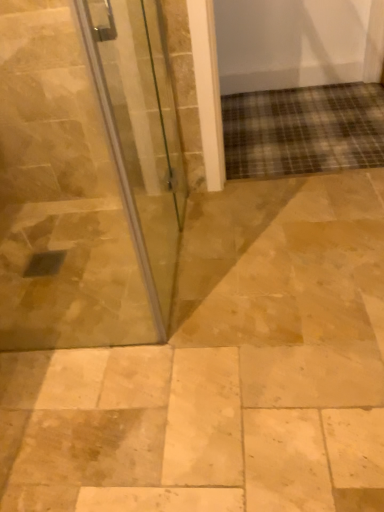
Question: Is natural stone tile at center far away from transparent glass door at left?

Choices:
 (A) yes
 (B) no

Answer: (B)

Question: From a real-world perspective, is natural stone tile at center on top of transparent glass door at left?

Choices:
 (A) yes
 (B) no

Answer: (B)

Question: Can you confirm if natural stone tile at center is taller than transparent glass door at left?

Choices:
 (A) yes
 (B) no

Answer: (B)

Question: Considering the relative sizes of natural stone tile at center and transparent glass door at left in the image provided, is natural stone tile at center bigger than transparent glass door at left?

Choices:
 (A) no
 (B) yes

Answer: (B)

Question: Is natural stone tile at center wider than transparent glass door at left?

Choices:
 (A) no
 (B) yes

Answer: (B)

Question: Is natural stone tile at center to the right of transparent glass door at left from the viewer's perspective?

Choices:
 (A) yes
 (B) no

Answer: (A)

Question: Is transparent glass door at left smaller than natural stone tile at center?

Choices:
 (A) yes
 (B) no

Answer: (A)

Question: From the image's perspective, is transparent glass door at left located above natural stone tile at center?

Choices:
 (A) no
 (B) yes

Answer: (B)

Question: Is transparent glass door at left positioned with its back to natural stone tile at center?

Choices:
 (A) yes
 (B) no

Answer: (B)

Question: Does transparent glass door at left have a greater height compared to natural stone tile at center?

Choices:
 (A) yes
 (B) no

Answer: (A)

Question: Does transparent glass door at left appear on the left side of natural stone tile at center?

Choices:
 (A) no
 (B) yes

Answer: (B)

Question: Is transparent glass door at left shorter than natural stone tile at center?

Choices:
 (A) yes
 (B) no

Answer: (B)

Question: From a real-world perspective, is transparent glass door at left physically located above or below natural stone tile at center?

Choices:
 (A) above
 (B) below

Answer: (A)